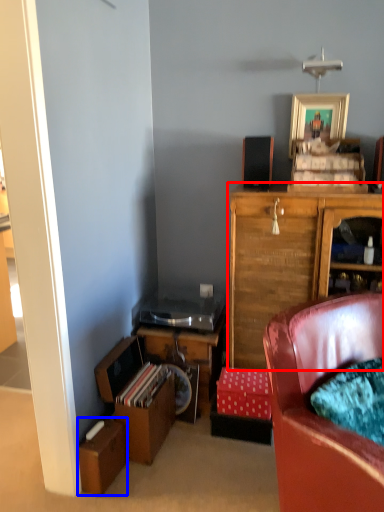
Question: Which point is closer to the camera, cabinetry (highlighted by a red box) or cardboard box (highlighted by a blue box)?

Choices:
 (A) cabinetry
 (B) cardboard box

Answer: (B)